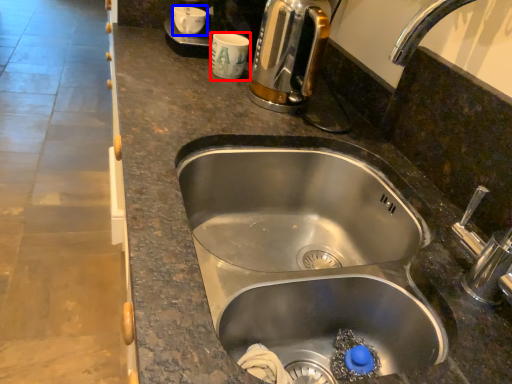
Question: Which object is closer to the camera taking this photo, coffee cup (highlighted by a red box) or coffee cup (highlighted by a blue box)?

Choices:
 (A) coffee cup
 (B) coffee cup

Answer: (A)